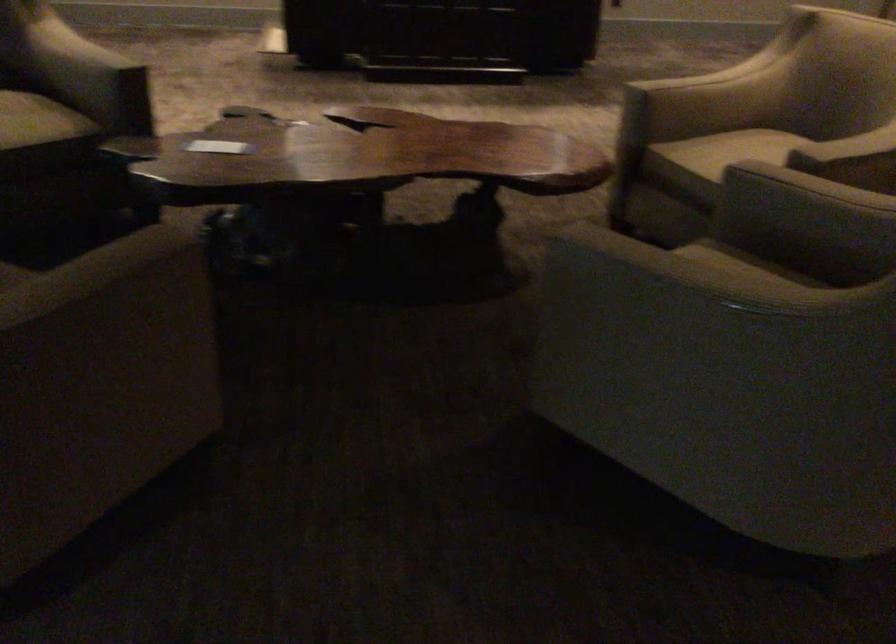
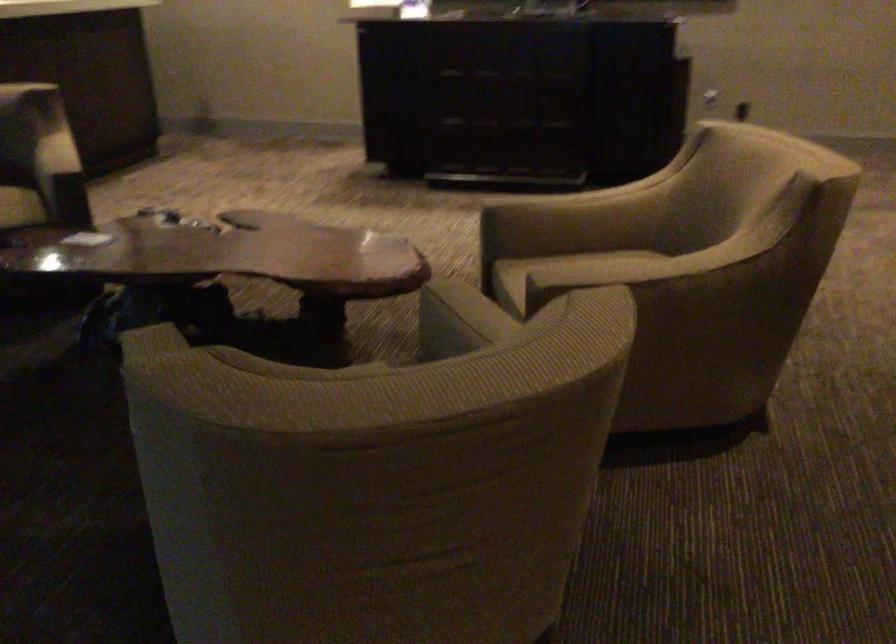
Find the pixel in the second image that matches [694,84] in the first image.

(547, 200)